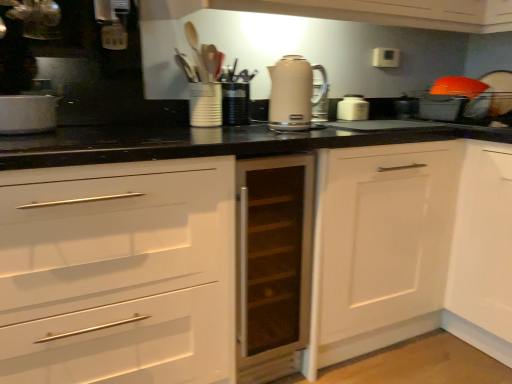
What do you see at coordinates (234, 103) in the screenshot? Image resolution: width=512 pixels, height=384 pixels. I see `black plastic container at center, the first appliance when ordered from right to left` at bounding box center [234, 103].

This screenshot has height=384, width=512. What do you see at coordinates (293, 93) in the screenshot? I see `beige glossy electric kettle at center, placed as the second kitchen appliance when sorted from back to front` at bounding box center [293, 93].

Describe the element at coordinates (273, 264) in the screenshot. This screenshot has height=384, width=512. I see `transparent glass cabinet at center, which appears as the second cabinetry when viewed from the right` at that location.

The width and height of the screenshot is (512, 384). I want to click on transparent glass cabinet at center, which appears as the second cabinetry when viewed from the right, so click(273, 264).

Describe the element at coordinates (205, 104) in the screenshot. I see `matte white container at center, acting as the 1th appliance starting from the left` at that location.

Find the location of a particular element. The width and height of the screenshot is (512, 384). black plastic container at center, the first appliance when ordered from right to left is located at coordinates (234, 103).

Would you consider satin silver wine cooler at center, placed as the 3th kitchen appliance when sorted from right to left, to be distant from matte white container at center, acting as the 1th appliance starting from the left?

No, there isn't a large distance between satin silver wine cooler at center, placed as the 3th kitchen appliance when sorted from right to left, and matte white container at center, acting as the 1th appliance starting from the left.

Considering the sizes of satin silver wine cooler at center, placed as the 3th kitchen appliance when sorted from right to left, and matte white container at center, which is counted as the 2th appliance, starting from the right, in the image, is satin silver wine cooler at center, placed as the 3th kitchen appliance when sorted from right to left, wider or thinner than matte white container at center, which is counted as the 2th appliance, starting from the right,?

Clearly, satin silver wine cooler at center, placed as the 3th kitchen appliance when sorted from right to left, has more width compared to matte white container at center, which is counted as the 2th appliance, starting from the right.

Does satin silver wine cooler at center, placed as the 1th kitchen appliance when sorted from front to back, have a smaller size compared to matte white container at center, acting as the 1th appliance starting from the left?

No.

Do you think satin silver wine cooler at center, the third kitchen appliance in the back-to-front sequence, is within matte white container at center, acting as the 1th appliance starting from the left, or outside of it?

The correct answer is: outside.

How far apart are beige glossy electric kettle at center, the second kitchen appliance from the right, and white glossy toaster at center, the first kitchen appliance positioned from the back?

beige glossy electric kettle at center, the second kitchen appliance from the right, is 46.13 centimeters away from white glossy toaster at center, the first kitchen appliance positioned from the back.

From the image's perspective, which one is positioned lower, beige glossy electric kettle at center, placed as the 2th kitchen appliance when sorted from front to back, or white glossy toaster at center, the first kitchen appliance positioned from the back?

beige glossy electric kettle at center, placed as the 2th kitchen appliance when sorted from front to back, is shown below in the image.

Is beige glossy electric kettle at center, placed as the second kitchen appliance when sorted from back to front, turned away from white glossy toaster at center, the first kitchen appliance positioned from the back?

No, beige glossy electric kettle at center, placed as the second kitchen appliance when sorted from back to front, is not facing the opposite direction of white glossy toaster at center, the first kitchen appliance positioned from the back.

Can you confirm if beige glossy electric kettle at center, arranged as the second kitchen appliance when viewed from the left, is smaller than white glossy toaster at center, which is counted as the third kitchen appliance, starting from the front?

No.

From the beige glossy electric kettle at center, arranged as the second kitchen appliance when viewed from the left, count the 2nd appliance to the left and point to it. Please provide its 2D coordinates.

[(205, 104)]

Considering the positions of objects beige glossy electric kettle at center, placed as the second kitchen appliance when sorted from back to front, and matte white container at center, which is counted as the 2th appliance, starting from the right, in the image provided, who is behind, beige glossy electric kettle at center, placed as the second kitchen appliance when sorted from back to front, or matte white container at center, which is counted as the 2th appliance, starting from the right,?

matte white container at center, which is counted as the 2th appliance, starting from the right.

Between beige glossy electric kettle at center, placed as the 2th kitchen appliance when sorted from front to back, and matte white container at center, acting as the 1th appliance starting from the left, which one has smaller size?

matte white container at center, acting as the 1th appliance starting from the left, is smaller.

Is beige glossy electric kettle at center, the second kitchen appliance from the right, taller or shorter than matte white container at center, acting as the 1th appliance starting from the left?

In the image, beige glossy electric kettle at center, the second kitchen appliance from the right, appears to be taller than matte white container at center, acting as the 1th appliance starting from the left.

Is matte white container at center, which is counted as the 2th appliance, starting from the right, inside or outside of white matte cabinet at lower right, which appears as the 1th cabinetry when viewed from the right?

matte white container at center, which is counted as the 2th appliance, starting from the right, is located beyond the bounds of white matte cabinet at lower right, which appears as the 1th cabinetry when viewed from the right.

Is matte white container at center, acting as the 1th appliance starting from the left, far away from white matte cabinet at lower right, the second cabinetry viewed from the left?

That's not correct — matte white container at center, acting as the 1th appliance starting from the left, is a little close to white matte cabinet at lower right, the second cabinetry viewed from the left.

Does matte white container at center, acting as the 1th appliance starting from the left, turn towards white matte cabinet at lower right, the second cabinetry viewed from the left?

No, matte white container at center, acting as the 1th appliance starting from the left, is not facing towards white matte cabinet at lower right, the second cabinetry viewed from the left.

Is beige glossy electric kettle at center, arranged as the second kitchen appliance when viewed from the left, located outside black plastic container at center, the first appliance when ordered from right to left?

beige glossy electric kettle at center, arranged as the second kitchen appliance when viewed from the left, lies outside black plastic container at center, the first appliance when ordered from right to left,'s area.

Is the depth of beige glossy electric kettle at center, placed as the second kitchen appliance when sorted from back to front, greater than that of black plastic container at center, the first appliance when ordered from right to left?

No, beige glossy electric kettle at center, placed as the second kitchen appliance when sorted from back to front, is closer to the viewer.

Is beige glossy electric kettle at center, arranged as the second kitchen appliance when viewed from the left, to the right of black plastic container at center, the first appliance when ordered from right to left, from the viewer's perspective?

Yes, beige glossy electric kettle at center, arranged as the second kitchen appliance when viewed from the left, is to the right of black plastic container at center, the first appliance when ordered from right to left.

Locate an element on the screen. the 1st kitchen appliance counting from the left of the white glossy toaster at center, which appears as the 1th kitchen appliance when viewed from the right is located at coordinates (293, 93).

From the image's perspective, is white glossy toaster at center, which appears as the 1th kitchen appliance when viewed from the right, below beige glossy electric kettle at center, arranged as the second kitchen appliance when viewed from the left?

Incorrect, from the image's perspective, white glossy toaster at center, which appears as the 1th kitchen appliance when viewed from the right, is higher than beige glossy electric kettle at center, arranged as the second kitchen appliance when viewed from the left.

Would you say white glossy toaster at center, which is the 3th kitchen appliance from left to right, is to the left or to the right of beige glossy electric kettle at center, arranged as the second kitchen appliance when viewed from the left, in the picture?

white glossy toaster at center, which is the 3th kitchen appliance from left to right, is to the right of beige glossy electric kettle at center, arranged as the second kitchen appliance when viewed from the left.

Is white glossy toaster at center, which is counted as the third kitchen appliance, starting from the front, in contact with beige glossy electric kettle at center, arranged as the second kitchen appliance when viewed from the left?

No, white glossy toaster at center, which is counted as the third kitchen appliance, starting from the front, is not touching beige glossy electric kettle at center, arranged as the second kitchen appliance when viewed from the left.

Who is taller, beige glossy electric kettle at center, arranged as the second kitchen appliance when viewed from the left, or white matte cabinet at lower right, the second cabinetry viewed from the left?

white matte cabinet at lower right, the second cabinetry viewed from the left.

Is beige glossy electric kettle at center, placed as the 2th kitchen appliance when sorted from front to back, next to white matte cabinet at lower right, which appears as the 1th cabinetry when viewed from the right?

No, beige glossy electric kettle at center, placed as the 2th kitchen appliance when sorted from front to back, is not in contact with white matte cabinet at lower right, which appears as the 1th cabinetry when viewed from the right.

Which cabinetry is the 1st one when counting from the front of the beige glossy electric kettle at center, arranged as the second kitchen appliance when viewed from the left? Please provide its 2D coordinates.

[(379, 246)]

Between beige glossy electric kettle at center, placed as the 2th kitchen appliance when sorted from front to back, and white matte cabinet at lower right, which appears as the 1th cabinetry when viewed from the right, which one has smaller size?

beige glossy electric kettle at center, placed as the 2th kitchen appliance when sorted from front to back, is smaller.

What are the coordinates of `kitchen appliance that is the 1st object directly below the matte white container at center, which is counted as the 2th appliance, starting from the right (from a real-world perspective)` in the screenshot? It's located at (27, 114).

At what (x,y) coordinates should I click in order to perform the action: click on kitchen appliance on the right of beige glossy electric kettle at center, placed as the 2th kitchen appliance when sorted from front to back. Please return your answer as a coordinate pair (x, y). This screenshot has height=384, width=512. Looking at the image, I should click on (353, 108).

Looking at the image, which one is located further to matte white container at center, which is counted as the 2th appliance, starting from the right, black plastic container at center, the first appliance when ordered from right to left, or satin silver wine cooler at center, placed as the 3th kitchen appliance when sorted from right to left?

satin silver wine cooler at center, placed as the 3th kitchen appliance when sorted from right to left, is further to matte white container at center, which is counted as the 2th appliance, starting from the right.

Considering their positions, is satin silver wine cooler at center, placed as the 3th kitchen appliance when sorted from right to left, positioned closer to beige glossy electric kettle at center, placed as the second kitchen appliance when sorted from back to front, than white matte cabinet at lower right, the second cabinetry viewed from the left?

Based on the image, white matte cabinet at lower right, the second cabinetry viewed from the left, appears to be nearer to beige glossy electric kettle at center, placed as the second kitchen appliance when sorted from back to front.

Looking at the image, which one is located further to beige glossy electric kettle at center, arranged as the second kitchen appliance when viewed from the left, transparent glass cabinet at center, which appears as the second cabinetry when viewed from the right, or white matte cabinet at lower right, the second cabinetry viewed from the left?

white matte cabinet at lower right, the second cabinetry viewed from the left, is further to beige glossy electric kettle at center, arranged as the second kitchen appliance when viewed from the left.

Which object lies further to the anchor point satin silver wine cooler at center, the 1th kitchen appliance in the left-to-right sequence, white glossy toaster at center, the first kitchen appliance positioned from the back, or matte white container at center, acting as the 1th appliance starting from the left?

Based on the image, white glossy toaster at center, the first kitchen appliance positioned from the back, appears to be further to satin silver wine cooler at center, the 1th kitchen appliance in the left-to-right sequence.

When comparing their distances from white matte cabinet at lower right, which appears as the 1th cabinetry when viewed from the right, does black plastic container at center, which ranks as the second appliance in left-to-right order, or beige glossy electric kettle at center, placed as the second kitchen appliance when sorted from back to front, seem further?

Among the two, black plastic container at center, which ranks as the second appliance in left-to-right order, is located further to white matte cabinet at lower right, which appears as the 1th cabinetry when viewed from the right.

Estimate the real-world distances between objects in this image. Which object is further from transparent glass cabinet at center, the 1th cabinetry positioned from the left, matte white container at center, acting as the 1th appliance starting from the left, or satin silver wine cooler at center, placed as the 1th kitchen appliance when sorted from front to back?

satin silver wine cooler at center, placed as the 1th kitchen appliance when sorted from front to back.

Looking at the image, which one is located further to white matte cabinet at lower right, the second cabinetry viewed from the left, black plastic container at center, the first appliance when ordered from right to left, or transparent glass cabinet at center, the 1th cabinetry positioned from the left?

Based on the image, black plastic container at center, the first appliance when ordered from right to left, appears to be further to white matte cabinet at lower right, the second cabinetry viewed from the left.

When comparing their distances from white matte cabinet at lower right, the second cabinetry viewed from the left, does satin silver wine cooler at center, placed as the 3th kitchen appliance when sorted from right to left, or white glossy toaster at center, which is the 3th kitchen appliance from left to right, seem further?

satin silver wine cooler at center, placed as the 3th kitchen appliance when sorted from right to left, is positioned further to the anchor white matte cabinet at lower right, the second cabinetry viewed from the left.

Identify the location of kitchen appliance located between satin silver wine cooler at center, placed as the 3th kitchen appliance when sorted from right to left, and white glossy toaster at center, which is counted as the third kitchen appliance, starting from the front, in the left-right direction. The height and width of the screenshot is (384, 512). (293, 93).

Find the location of a particular element. The width and height of the screenshot is (512, 384). kitchen appliance between matte white container at center, which is counted as the 2th appliance, starting from the right, and white glossy toaster at center, which appears as the 1th kitchen appliance when viewed from the right is located at coordinates (293, 93).

This screenshot has height=384, width=512. Find the location of `cabinetry situated between satin silver wine cooler at center, the 1th kitchen appliance in the left-to-right sequence, and white glossy toaster at center, which is counted as the third kitchen appliance, starting from the front, from left to right`. cabinetry situated between satin silver wine cooler at center, the 1th kitchen appliance in the left-to-right sequence, and white glossy toaster at center, which is counted as the third kitchen appliance, starting from the front, from left to right is located at coordinates (273, 264).

Find the location of `cabinetry between satin silver wine cooler at center, placed as the 3th kitchen appliance when sorted from right to left, and beige glossy electric kettle at center, arranged as the second kitchen appliance when viewed from the left`. cabinetry between satin silver wine cooler at center, placed as the 3th kitchen appliance when sorted from right to left, and beige glossy electric kettle at center, arranged as the second kitchen appliance when viewed from the left is located at coordinates (273, 264).